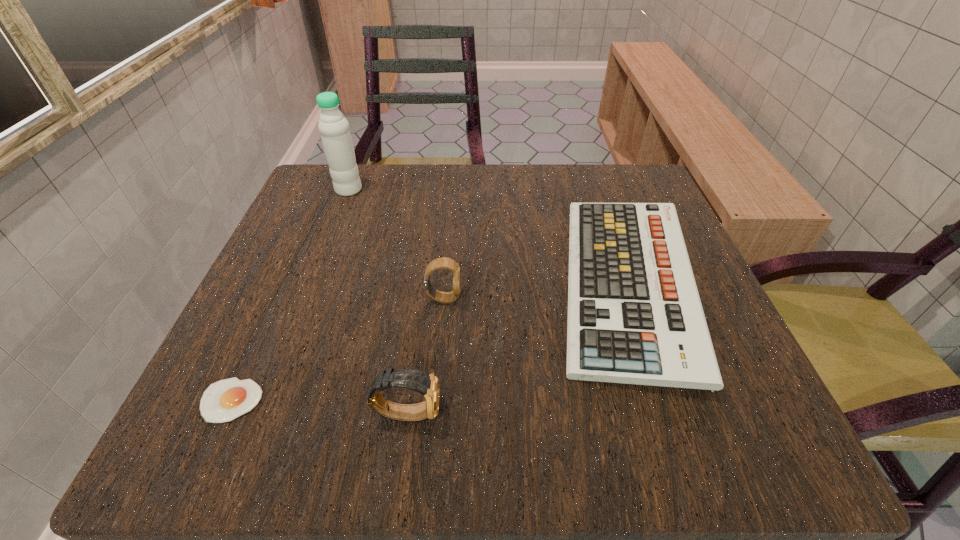
In order to click on vacant space located 0.160m on the back of the fourth tallest object in this screenshot , I will do (588, 170).

Locate an element on the screen. vacant region located 0.170m on the right of the shortest object is located at coordinates (386, 400).

Where is `water bottle situated at the far edge`? water bottle situated at the far edge is located at coordinates (334, 128).

Image resolution: width=960 pixels, height=540 pixels. I want to click on computer keyboard present at the far edge, so click(634, 313).

I want to click on watch present at the near edge, so click(x=427, y=384).

Identify the location of computer keyboard at the near edge. (634, 313).

You are a GUI agent. You are given a task and a screenshot of the screen. Output one action in this format:
    pyautogui.click(x=<x>, y=<y>)
    Task: Click on the egg yolk that is at the near edge
    
    Given the screenshot: What is the action you would take?
    pyautogui.click(x=225, y=400)

Locate an element on the screen. water bottle situated at the left edge is located at coordinates (334, 128).

The width and height of the screenshot is (960, 540). In order to click on egg yolk that is at the left edge in this screenshot , I will do `click(225, 400)`.

At what (x,y) coordinates should I click in order to perform the action: click on object located at the right edge. Please return your answer as a coordinate pair (x, y). The image size is (960, 540). Looking at the image, I should click on (634, 313).